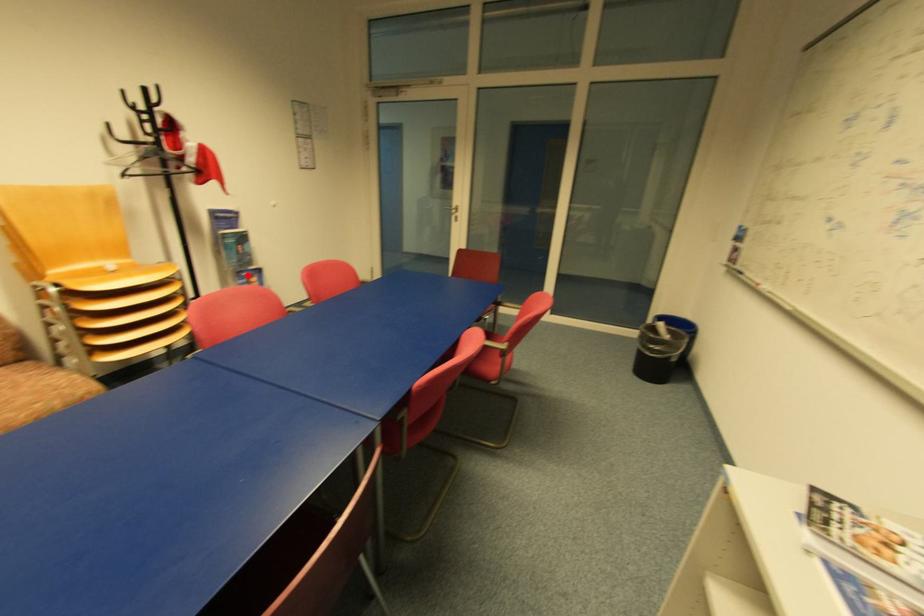
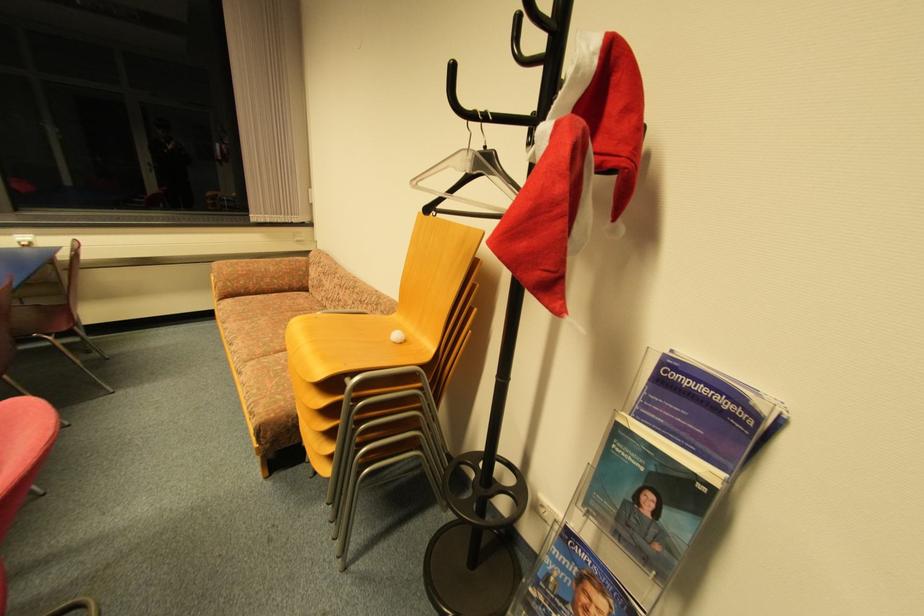
The point at the highlighted location is marked in the first image. Where is the corresponding point in the second image?

(588, 557)